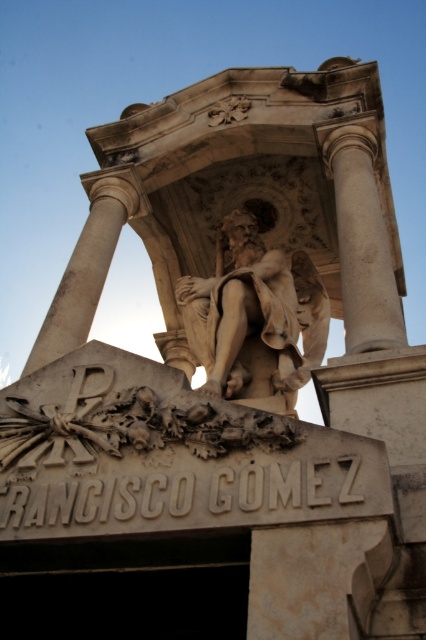
You are standing in front of the monument of Francisco Gomez. You want to take a photo of the statue of the seated figure holding a scroll. The camera you are using has a maximum focus range of 60 meters. Is the point at coordinates point (x=213, y=280) within the camera focus range?

The distance between point (x=213, y=280) and the camera is 59.00 meters, which is within the camera focus range of 60 meters. Therefore, the point is within range.

You are a visitor standing in front of the monument. You notice the beige stone statue at center and the white marble column at center. Which object is positioned higher up in the image?

The white marble column at center is positioned higher up in the image than the beige stone statue at center.

You are an art conservator assessing the monument. You notice the beige stone statue at center and the white marble column at center. Which object is shorter in height?

The beige stone statue at center is shorter in height compared to the white marble column at center.